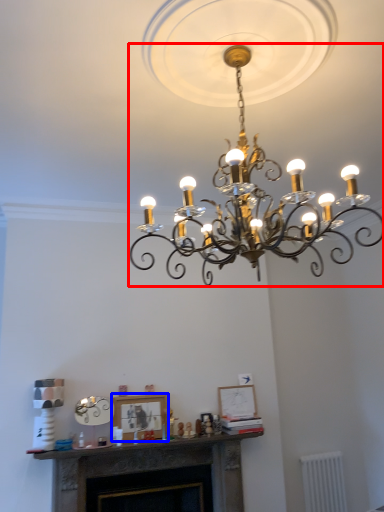
Question: Which of the following is the closest to the observer, lamp (highlighted by a red box) or picture frame (highlighted by a blue box)?

Choices:
 (A) lamp
 (B) picture frame

Answer: (A)